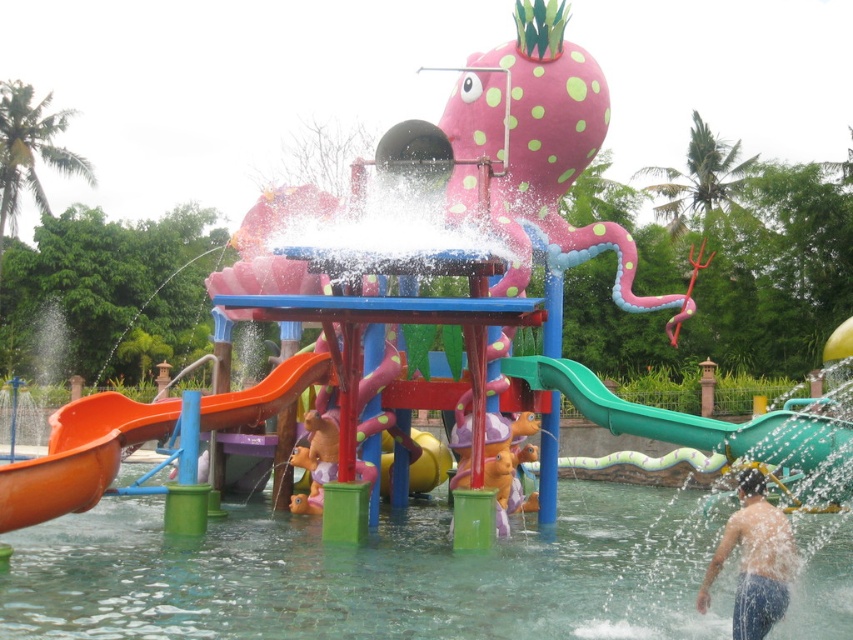
You are a child trying to reach the orange matte slide at lower left from the clear water at center. Which direction should you move to get closer to the slide?

Since the clear water at center is closer to the viewer than the orange matte slide at lower left, you should move backward to get closer to the orange matte slide at lower left.

You are a parent watching your child play in the water area. You notice the clear water at center and the smooth skin person at lower right. Which one is taller?

The smooth skin person at lower right is taller than the clear water at center.